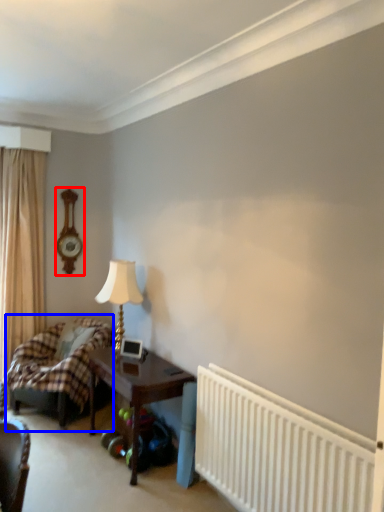
Question: Which object appears farthest to the camera in this image, clock (highlighted by a red box) or bed (highlighted by a blue box)?

Choices:
 (A) clock
 (B) bed

Answer: (A)